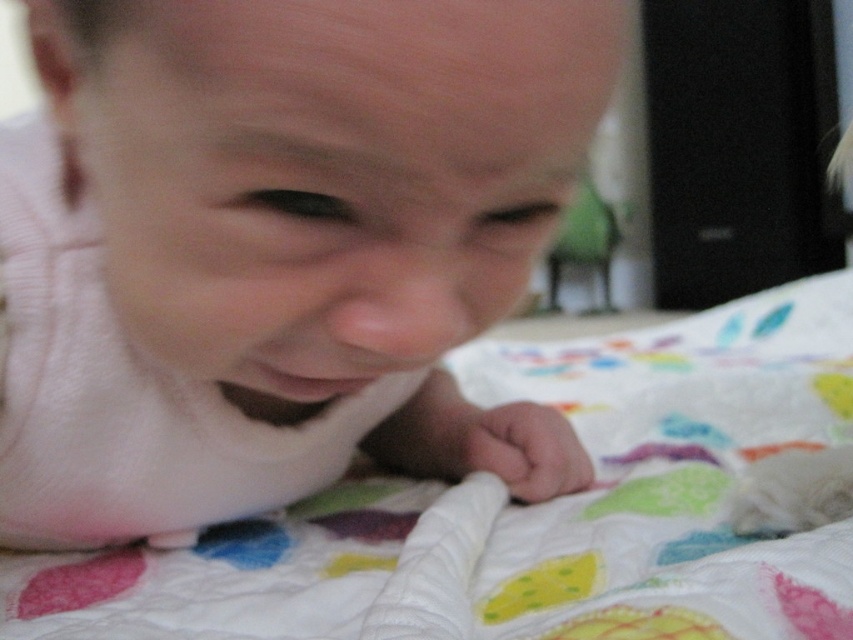
From the picture: You are a photographer setting up a shoot with a pink soft fabric baby at center and a white quilt at center. You want to ensure the baby is positioned to the left of the quilt for the composition. Is the current arrangement correct?

Yes, the current arrangement is correct because the pink soft fabric baby at center is already positioned to the left of the white quilt at center as described in the scene.

The baby is lying on a colorful quilt with various geometric shapes. There is a specific point marked at coordinates point (x=277, y=250). What is the significance of this point in relation to the baby?

Point (x=277, y=250) marks the location of the pink soft fabric baby at center.

Consider the image. You are a photographer trying to capture the baby in the image. Since the baby is moving, you need to know which object is closer to the camera to focus properly. Which is closer to the camera, the pink soft fabric baby at center or the white quilt at center?

The pink soft fabric baby at center is in front of the white quilt at center, so it is closer to the camera.